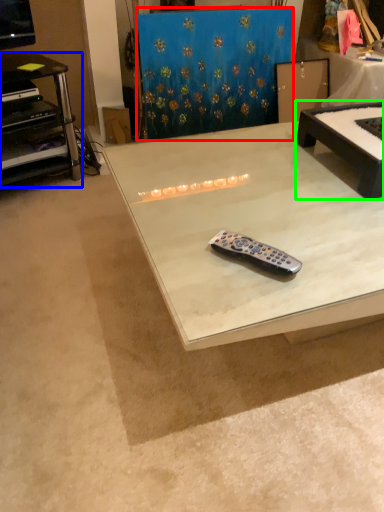
Question: Estimate the real-world distances between objects in this image. Which object is closer to curtain (highlighted by a red box), desk (highlighted by a blue box) or table (highlighted by a green box)?

Choices:
 (A) desk
 (B) table

Answer: (A)